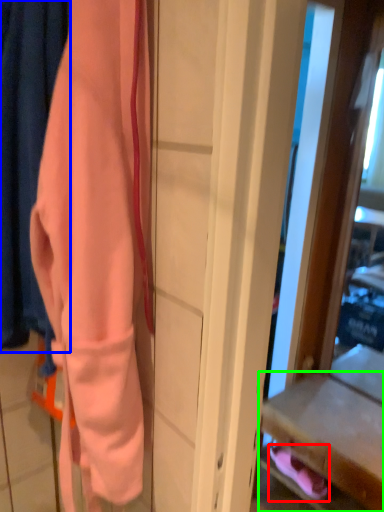
Question: Which is farther away from footwear (highlighted by a red box)? curtain (highlighted by a blue box) or drawer (highlighted by a green box)?

Choices:
 (A) curtain
 (B) drawer

Answer: (A)